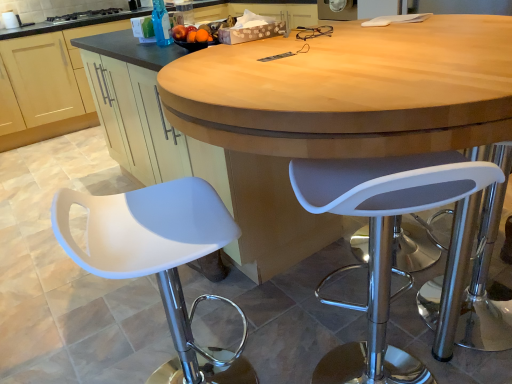
Describe the element at coordinates (50, 86) in the screenshot. I see `matte wood cabinet at lower left` at that location.

This screenshot has width=512, height=384. What do you see at coordinates (87, 15) in the screenshot?
I see `black glass stove at upper left` at bounding box center [87, 15].

In order to face transparent plastic bottle at upper center, should I rotate leftwards or rightwards?

Rotate your view left by about 13.055°.

How much space does white matte stool at left, positioned as the first chair in left-to-right order, occupy horizontally?

The width of white matte stool at left, positioned as the first chair in left-to-right order, is 15.25 inches.

Image resolution: width=512 pixels, height=384 pixels. What are the coordinates of `matte wood table at center` in the screenshot? It's located at (350, 91).

I want to click on matte wood cabinet at lower left, so click(50, 86).

Looking at this image, can you tell me how much transparent plastic bottle at upper center and white matte stool at left, positioned as the first chair in left-to-right order, differ in facing direction?

They differ by 121 degrees in their facing directions.

Is transparent plastic bottle at upper center shorter than white matte stool at left, the 2th chair positioned from the right?

Yes.

How far apart are transparent plastic bottle at upper center and white matte stool at left, the 2th chair positioned from the right?

transparent plastic bottle at upper center and white matte stool at left, the 2th chair positioned from the right, are 3.80 feet apart.

Locate an element on the screen. This screenshot has width=512, height=384. the 2nd chair below the transparent plastic bottle at upper center (from a real-world perspective) is located at coordinates (160, 261).

From the image's perspective, who appears lower, matte wood cabinet at lower left or white matte stool at left, positioned as the first chair in left-to-right order?

From the image's view, white matte stool at left, positioned as the first chair in left-to-right order, is below.

Would you consider matte wood cabinet at lower left to be distant from white matte stool at left, the 2th chair positioned from the right?

Indeed, matte wood cabinet at lower left is not near white matte stool at left, the 2th chair positioned from the right.

Is matte wood cabinet at lower left at the right side of white matte stool at left, positioned as the first chair in left-to-right order?

Incorrect, matte wood cabinet at lower left is not on the right side of white matte stool at left, positioned as the first chair in left-to-right order.

Looking at this image, would you say matte wood cabinet at lower left is inside or outside white matte stool at left, positioned as the first chair in left-to-right order?

The correct answer is: outside.

Is matte wood cabinet at lower left inside the boundaries of matte wood table at center, or outside?

matte wood cabinet at lower left cannot be found inside matte wood table at center.

At what (x,y) coordinates should I click in order to perform the action: click on table that appears below the matte wood cabinet at lower left (from the image's perspective). Please return your answer as a coordinate pair (x, y). The height and width of the screenshot is (384, 512). Looking at the image, I should click on (350, 91).

Which of these two, matte wood cabinet at lower left or matte wood table at center, is bigger?

With larger size is matte wood cabinet at lower left.

Is matte wood cabinet at lower left not close to matte wood table at center?

Absolutely, matte wood cabinet at lower left is distant from matte wood table at center.

From the picture: From the image's perspective, is white matte stool at left, the 2th chair positioned from the right, located above transparent plastic bottle at upper center?

No, from the image's perspective, white matte stool at left, the 2th chair positioned from the right, is not over transparent plastic bottle at upper center.

Is there a large distance between white matte stool at left, positioned as the first chair in left-to-right order, and transparent plastic bottle at upper center?

Yes.

From a real-world perspective, is white matte stool at left, the 2th chair positioned from the right, physically above transparent plastic bottle at upper center?

No.

Is white matte stool at left, positioned as the first chair in left-to-right order, spatially inside transparent plastic bottle at upper center, or outside of it?

white matte stool at left, positioned as the first chair in left-to-right order, is not inside transparent plastic bottle at upper center, it's outside.

In the scene shown: Is white matte stool at left, positioned as the first chair in left-to-right order, bigger or smaller than matte wood table at center?

In the image, white matte stool at left, positioned as the first chair in left-to-right order, appears to be smaller than matte wood table at center.

From the image's perspective, would you say white matte stool at left, the 2th chair positioned from the right, is positioned over matte wood table at center?

Actually, white matte stool at left, the 2th chair positioned from the right, appears below matte wood table at center in the image.

Looking at their sizes, would you say white matte stool at left, positioned as the first chair in left-to-right order, is wider or thinner than matte wood table at center?

Clearly, white matte stool at left, positioned as the first chair in left-to-right order, has less width compared to matte wood table at center.

Considering the relative positions of matte wood table at center and white plastic stool at right, which is counted as the 1th chair, starting from the right, in the image provided, is matte wood table at center in front of white plastic stool at right, which is counted as the 1th chair, starting from the right,?

That is True.

Does matte wood table at center contain white plastic stool at right, marked as the 2th chair in a left-to-right arrangement?

That's correct, white plastic stool at right, marked as the 2th chair in a left-to-right arrangement, is inside matte wood table at center.

Is matte wood table at center to the left of white plastic stool at right, which is counted as the 1th chair, starting from the right, from the viewer's perspective?

No.

From a real-world perspective, who is located higher, matte wood table at center or white plastic stool at right, marked as the 2th chair in a left-to-right arrangement?

In real-world perspective, matte wood table at center is above.

Between white matte stool at left, positioned as the first chair in left-to-right order, and black glass stove at upper left, which one has larger width?

Wider between the two is black glass stove at upper left.

I want to click on the 1st chair counting from the right of the black glass stove at upper left, so click(160, 261).

Is white matte stool at left, positioned as the first chair in left-to-right order, turned away from black glass stove at upper left?

No, black glass stove at upper left is not at the back of white matte stool at left, positioned as the first chair in left-to-right order.

What's the angular difference between white matte stool at left, the 2th chair positioned from the right, and black glass stove at upper left's facing directions?

The angular difference between white matte stool at left, the 2th chair positioned from the right, and black glass stove at upper left is 76.2 degrees.

Identify the location of bottle behind the white matte stool at left, the 2th chair positioned from the right. (161, 24).

From a real-world perspective, count 2nd chairs downward from the matte wood cabinet at lower left and point to it. Please provide its 2D coordinates.

[(160, 261)]

Based on their spatial positions, is matte wood cabinet at lower left or transparent plastic bottle at upper center further from matte wood table at center?

matte wood cabinet at lower left is positioned further to the anchor matte wood table at center.

Which object lies nearer to the anchor point matte wood table at center, black glass stove at upper left or matte wood cabinet at lower left?

matte wood cabinet at lower left is closer to matte wood table at center.

Which object lies further to the anchor point matte wood cabinet at lower left, transparent plastic bottle at upper center or white matte stool at left, positioned as the first chair in left-to-right order?

white matte stool at left, positioned as the first chair in left-to-right order, lies further to matte wood cabinet at lower left than the other object.

Considering their positions, is transparent plastic bottle at upper center positioned closer to matte wood cabinet at lower left than white plastic stool at right, marked as the 2th chair in a left-to-right arrangement?

Among the two, transparent plastic bottle at upper center is located nearer to matte wood cabinet at lower left.

Which object lies nearer to the anchor point matte wood cabinet at lower left, white plastic stool at right, marked as the 2th chair in a left-to-right arrangement, or white matte stool at left, positioned as the first chair in left-to-right order?

white matte stool at left, positioned as the first chair in left-to-right order.

From the picture: Looking at the image, which one is located further to black glass stove at upper left, white plastic stool at right, marked as the 2th chair in a left-to-right arrangement, or transparent plastic bottle at upper center?

white plastic stool at right, marked as the 2th chair in a left-to-right arrangement, is positioned further to the anchor black glass stove at upper left.

From the image, which object appears to be farther from matte wood table at center, transparent plastic bottle at upper center or white plastic stool at right, which is counted as the 1th chair, starting from the right?

transparent plastic bottle at upper center lies further to matte wood table at center than the other object.

Based on their spatial positions, is matte wood table at center or matte wood cabinet at lower left further from transparent plastic bottle at upper center?

matte wood cabinet at lower left is further to transparent plastic bottle at upper center.

I want to click on cabinetry located between transparent plastic bottle at upper center and black glass stove at upper left in the depth direction, so click(x=50, y=86).

Image resolution: width=512 pixels, height=384 pixels. Find the location of `bottle between white matte stool at left, the 2th chair positioned from the right, and black glass stove at upper left, along the z-axis`. bottle between white matte stool at left, the 2th chair positioned from the right, and black glass stove at upper left, along the z-axis is located at coordinates (161, 24).

Find the location of a particular element. This screenshot has height=384, width=512. cabinetry located between matte wood table at center and black glass stove at upper left in the depth direction is located at coordinates (50, 86).

At what (x,y) coordinates should I click in order to perform the action: click on bottle between white plastic stool at right, marked as the 2th chair in a left-to-right arrangement, and matte wood cabinet at lower left from front to back. Please return your answer as a coordinate pair (x, y). This screenshot has width=512, height=384. Looking at the image, I should click on (161, 24).